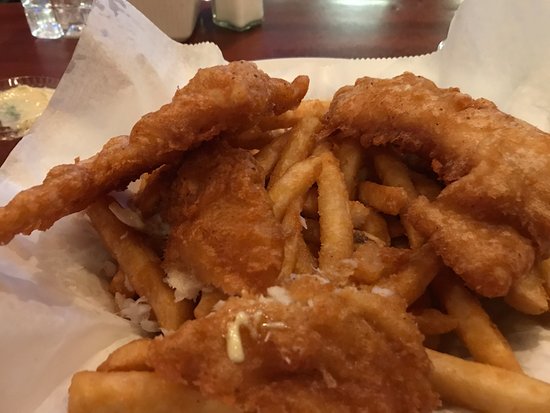
Locate an element on the screen. glass is located at coordinates (33, 20).